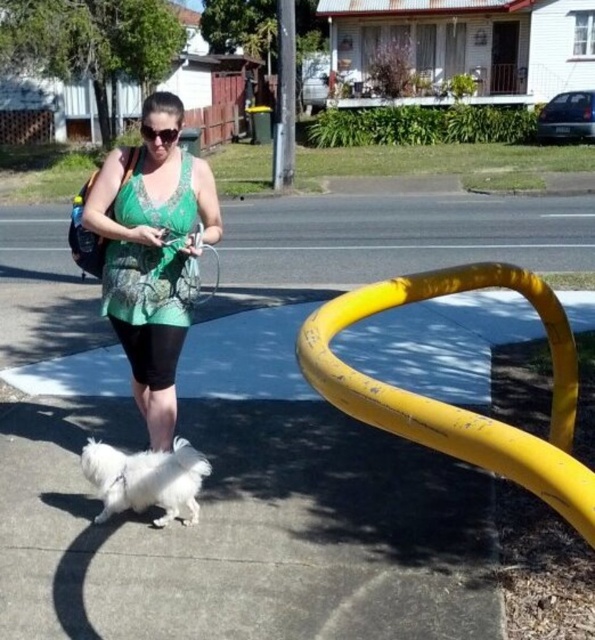
Question: Which point appears farthest from the camera in this image?

Choices:
 (A) (146, 323)
 (B) (283, 310)

Answer: (B)

Question: Is yellow rubber pavement at center to the right of white fluffy dog at lower left from the viewer's perspective?

Choices:
 (A) yes
 (B) no

Answer: (A)

Question: Is yellow rubber pavement at center below white fluffy dog at lower left?

Choices:
 (A) yes
 (B) no

Answer: (B)

Question: Which of the following is the farthest from the observer?

Choices:
 (A) green lace dress at center
 (B) yellow rubber pavement at center

Answer: (A)

Question: Among these points, which one is nearest to the camera?

Choices:
 (A) (174, 150)
 (B) (146, 480)
 (C) (521, 200)

Answer: (B)

Question: Is green lace dress at center wider than white fluffy dog at lower left?

Choices:
 (A) no
 (B) yes

Answer: (B)